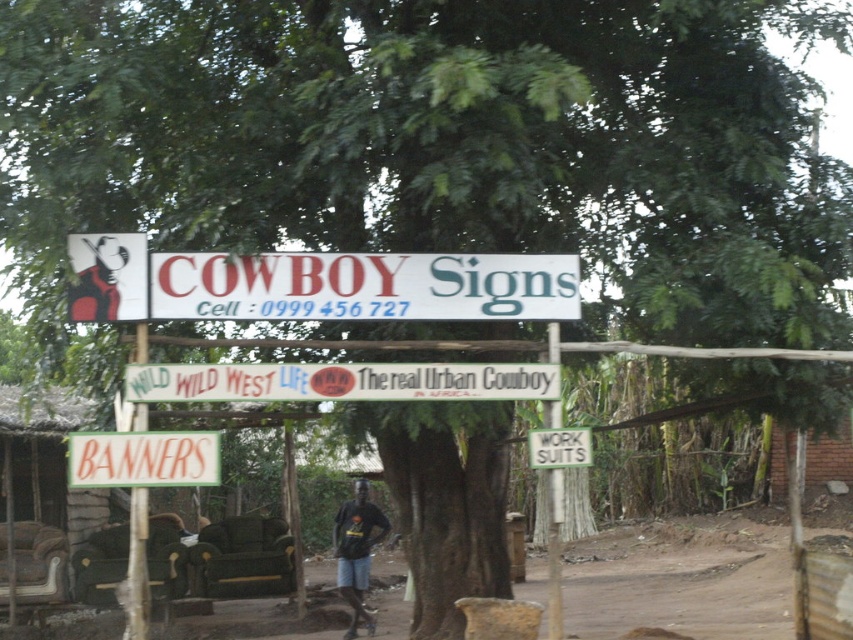
Question: Which point is farther to the camera?

Choices:
 (A) orange matte banners at center
 (B) green fabric banner at left

Answer: (B)

Question: Which point is closer to the camera?

Choices:
 (A) dark blue fabric shirt at center
 (B) white plastic signboard at center

Answer: (B)

Question: Is brown dirt field at lower center positioned in front of white wooden signboard at center?

Choices:
 (A) yes
 (B) no

Answer: (B)

Question: Does dark blue fabric shirt at center have a smaller size compared to green wood signpost at center?

Choices:
 (A) yes
 (B) no

Answer: (B)

Question: Which point is closer to the camera?

Choices:
 (A) (234, 387)
 (B) (219, 454)

Answer: (A)

Question: Is green fabric banner at center bigger than red matte sign at upper left?

Choices:
 (A) no
 (B) yes

Answer: (B)